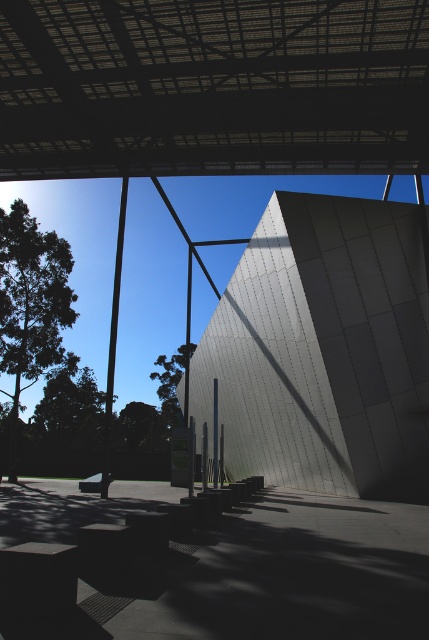
Question: Which point is closer to the camera?

Choices:
 (A) (12, 460)
 (B) (392, 280)

Answer: (B)

Question: Among these points, which one is farthest from the camera?

Choices:
 (A) (171, 378)
 (B) (36, 339)
 (C) (145, 122)

Answer: (A)

Question: Can you confirm if smooth gray wall at center is positioned to the right of green leafy tree at left?

Choices:
 (A) yes
 (B) no

Answer: (A)

Question: Can you confirm if metallic grid canopy at upper center is smaller than green leafy tree at left?

Choices:
 (A) yes
 (B) no

Answer: (A)

Question: Estimate the real-world distances between objects in this image. Which object is farther from the smooth gray wall at center?

Choices:
 (A) metallic grid canopy at upper center
 (B) green leafy tree at left

Answer: (B)

Question: Does green leafy tree at left have a lesser width compared to green leafy tree at center?

Choices:
 (A) no
 (B) yes

Answer: (A)